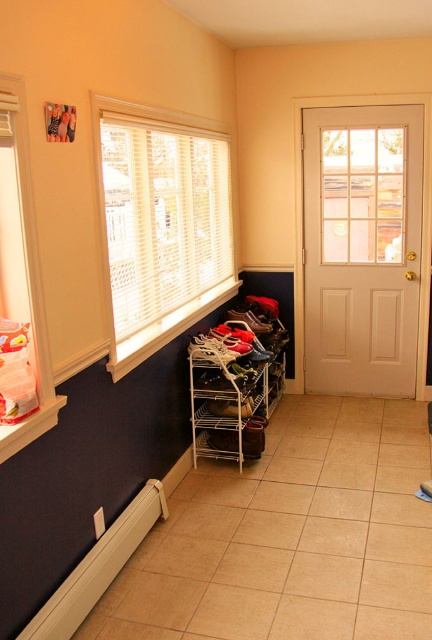
Can you confirm if white matte door at right is shorter than white metal shoe rack at center?

No, white matte door at right is not shorter than white metal shoe rack at center.

Who is more forward, (304, 264) or (212, 440)?

→ Point (212, 440) is in front.

Between point (314, 276) and point (219, 442), which one is positioned in front?

Point (219, 442)

This screenshot has width=432, height=640. Find the location of `white matte door at right`. white matte door at right is located at coordinates (362, 248).

Does point (168, 186) come in front of point (222, 387)?

No.

Is white blinds at upper left to the left of white metal shoe rack at center from the viewer's perspective?

Correct, you'll find white blinds at upper left to the left of white metal shoe rack at center.

Is point (133, 253) positioned before point (245, 385)?

Yes.

Where is `white blinds at upper left`? The width and height of the screenshot is (432, 640). white blinds at upper left is located at coordinates (161, 224).

Is white blinds at upper left further to camera compared to white plastic baseboard at lower left?

That is True.

Can you confirm if white blinds at upper left is thinner than white plastic baseboard at lower left?

No.

Is point (181, 182) closer to camera compared to point (155, 500)?

No, it is behind (155, 500).

Find the location of a particular element. white blinds at upper left is located at coordinates (161, 224).